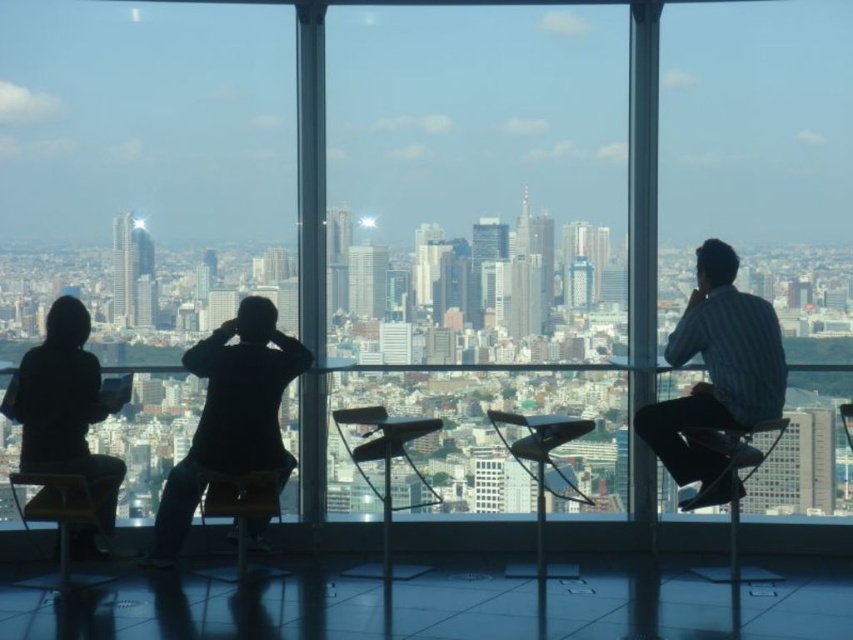
Question: Which object appears closest to the camera in this image?

Choices:
 (A) metallic silver chair at center
 (B) black matte jacket at center

Answer: (A)

Question: Which point appears farthest from the camera in this image?

Choices:
 (A) (154, 531)
 (B) (682, 344)
 (C) (357, 422)
 (D) (273, 573)

Answer: (A)

Question: In this image, where is metallic black chair at right located relative to wooden chair at center?

Choices:
 (A) below
 (B) above

Answer: (B)

Question: Observing the image, what is the correct spatial positioning of silhouette jacket at left in reference to metallic silver chair at center?

Choices:
 (A) below
 (B) above

Answer: (B)

Question: Does metallic silver chair at center have a larger size compared to wooden chair at center?

Choices:
 (A) no
 (B) yes

Answer: (B)

Question: Which point is farther to the camera?

Choices:
 (A) wooden chair at center
 (B) wooden chair at lower left
 (C) metallic silver chair at center

Answer: (B)